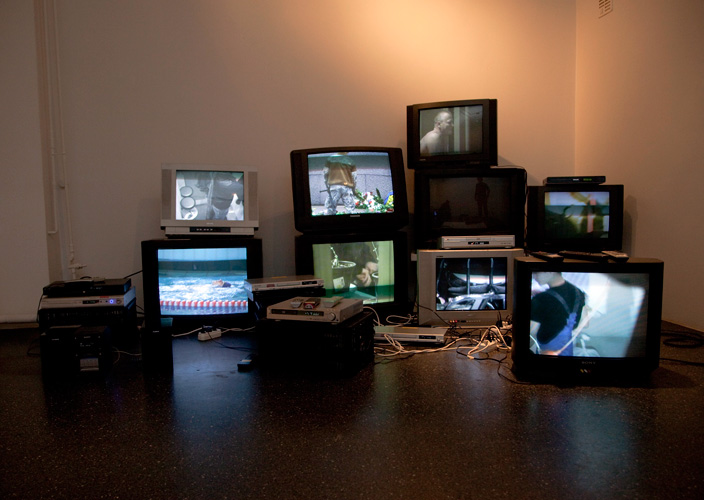
At what (x,y) coordinates should I click in order to perform the action: click on light shining on wall. Please return your answer as a coordinate pair (x, y). The width and height of the screenshot is (704, 500). Looking at the image, I should click on (429, 36).